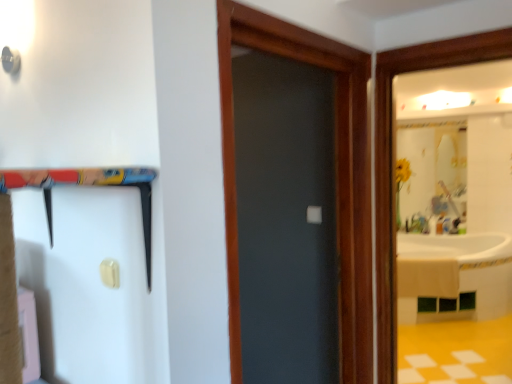
Question: Is matte gray door at center with white plastic barn door at upper left?

Choices:
 (A) no
 (B) yes

Answer: (A)

Question: Are matte gray door at center and white plastic barn door at upper left located far from each other?

Choices:
 (A) no
 (B) yes

Answer: (A)

Question: Is matte gray door at center surrounding white plastic barn door at upper left?

Choices:
 (A) yes
 (B) no

Answer: (B)

Question: From a real-world perspective, is matte gray door at center located beneath white plastic barn door at upper left?

Choices:
 (A) yes
 (B) no

Answer: (B)

Question: Is matte gray door at center wider than white plastic barn door at upper left?

Choices:
 (A) no
 (B) yes

Answer: (A)

Question: From the image's perspective, does matte gray door at center appear higher than white plastic barn door at upper left?

Choices:
 (A) yes
 (B) no

Answer: (A)

Question: Is white plastic barn door at upper left outside of matte gray door at center?

Choices:
 (A) no
 (B) yes

Answer: (B)

Question: From a real-world perspective, is white plastic barn door at upper left on matte gray door at center?

Choices:
 (A) no
 (B) yes

Answer: (A)

Question: Does white plastic barn door at upper left have a lesser height compared to matte gray door at center?

Choices:
 (A) no
 (B) yes

Answer: (B)

Question: From a real-world perspective, is white plastic barn door at upper left below matte gray door at center?

Choices:
 (A) yes
 (B) no

Answer: (A)

Question: Is white plastic barn door at upper left thinner than matte gray door at center?

Choices:
 (A) no
 (B) yes

Answer: (A)

Question: Is white plastic barn door at upper left behind matte gray door at center?

Choices:
 (A) yes
 (B) no

Answer: (B)

Question: Considering their positions, is matte gray door at center located in front of or behind white plastic barn door at upper left?

Choices:
 (A) behind
 (B) front

Answer: (A)